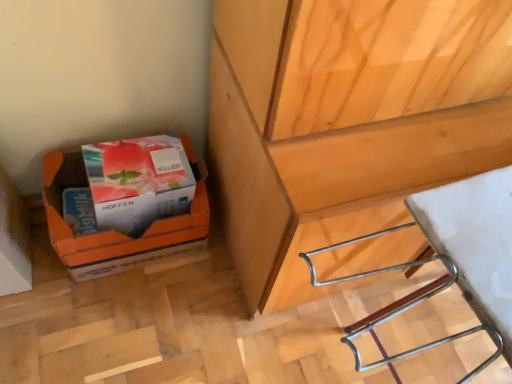
Image resolution: width=512 pixels, height=384 pixels. Identify the location of orange cardboard box at lower left. (115, 231).

You are a GUI agent. You are given a task and a screenshot of the screen. Output one action in this format:
    pyautogui.click(x=<x>, y=<y>)
    Task: Click on the white plastic stool at lower right
    
    Given the screenshot: What is the action you would take?
    pyautogui.click(x=460, y=258)

Is white plastic stool at lower right further to camera compared to orange cardboard box at lower left?

No, white plastic stool at lower right is closer to the viewer.

Considering the sizes of objects white plastic stool at lower right and orange cardboard box at lower left in the image provided, who is shorter, white plastic stool at lower right or orange cardboard box at lower left?

orange cardboard box at lower left is shorter.

How many degrees apart are the facing directions of white plastic stool at lower right and orange cardboard box at lower left?

white plastic stool at lower right and orange cardboard box at lower left are facing 5.37 degrees away from each other.

Is white plastic stool at lower right facing towards orange cardboard box at lower left?

No, white plastic stool at lower right is not oriented towards orange cardboard box at lower left.

Between point (200, 217) and point (168, 165), which one is positioned behind?

The point (200, 217) is farther.

Considering their positions, is orange cardboard box at lower left located in front of or behind matte white box at lower left?

Clearly, orange cardboard box at lower left is behind matte white box at lower left.

Considering the sizes of objects orange cardboard box at lower left and matte white box at lower left in the image provided, who is shorter, orange cardboard box at lower left or matte white box at lower left?

Standing shorter between the two is matte white box at lower left.

From their relative heights in the image, would you say matte white box at lower left is taller or shorter than orange cardboard box at lower left?

matte white box at lower left is shorter than orange cardboard box at lower left.

Which of these two, matte white box at lower left or orange cardboard box at lower left, is thinner?

matte white box at lower left.

From a real-world perspective, which is physically above, matte white box at lower left or orange cardboard box at lower left?

matte white box at lower left.

Looking at this image, are matte white box at lower left and white plastic stool at lower right making contact?

No, matte white box at lower left is not making contact with white plastic stool at lower right.

From the picture: In terms of width, does matte white box at lower left look wider or thinner when compared to white plastic stool at lower right?

matte white box at lower left is thinner than white plastic stool at lower right.

Is white plastic stool at lower right at the back of matte white box at lower left?

No, white plastic stool at lower right is not at the back of matte white box at lower left.

From the image's perspective, which object appears higher, matte white box at lower left or white plastic stool at lower right?

matte white box at lower left.

Between white plastic stool at lower right and matte white box at lower left, which one appears on the left side from the viewer's perspective?

matte white box at lower left is more to the left.

How different are the orientations of white plastic stool at lower right and matte white box at lower left in degrees?

5.37 degrees.

Considering the points (503, 287) and (164, 171), which point is behind, point (503, 287) or point (164, 171)?

The point (164, 171) is farther from the camera.

Which object is wider, white plastic stool at lower right or matte white box at lower left?

white plastic stool at lower right.

Is orange cardboard box at lower left further to camera compared to white plastic stool at lower right?

Yes, it is behind white plastic stool at lower right.

Based on the photo, from a real-world perspective, relative to white plastic stool at lower right, is orange cardboard box at lower left vertically above or below?

In terms of real-world spatial position, orange cardboard box at lower left is below white plastic stool at lower right.

Could you tell me if orange cardboard box at lower left is turned towards white plastic stool at lower right?

No, orange cardboard box at lower left is not oriented towards white plastic stool at lower right.

Considering the relative sizes of orange cardboard box at lower left and white plastic stool at lower right in the image provided, is orange cardboard box at lower left taller than white plastic stool at lower right?

Incorrect, the height of orange cardboard box at lower left is not larger of that of white plastic stool at lower right.

Where is `wood on the right of orange cardboard box at lower left`? This screenshot has height=384, width=512. wood on the right of orange cardboard box at lower left is located at coordinates (460, 258).

Locate an element on the screen. paperback book that is in front of the orange cardboard box at lower left is located at coordinates (138, 182).

Which object lies nearer to the anchor point orange cardboard box at lower left, white plastic stool at lower right or matte white box at lower left?

matte white box at lower left is closer to orange cardboard box at lower left.

Estimate the real-world distances between objects in this image. Which object is further from matte white box at lower left, orange cardboard box at lower left or white plastic stool at lower right?

white plastic stool at lower right is further to matte white box at lower left.

Which object lies further to the anchor point white plastic stool at lower right, orange cardboard box at lower left or matte white box at lower left?

orange cardboard box at lower left is further to white plastic stool at lower right.

Looking at the image, which one is located closer to matte white box at lower left, white plastic stool at lower right or orange cardboard box at lower left?

orange cardboard box at lower left is closer to matte white box at lower left.

Based on their spatial positions, is matte white box at lower left or orange cardboard box at lower left further from white plastic stool at lower right?

The object further to white plastic stool at lower right is orange cardboard box at lower left.

Based on their spatial positions, is matte white box at lower left or white plastic stool at lower right closer to orange cardboard box at lower left?

matte white box at lower left is positioned closer to the anchor orange cardboard box at lower left.

The height and width of the screenshot is (384, 512). In order to click on paperback book between orange cardboard box at lower left and white plastic stool at lower right from left to right in this screenshot , I will do `click(138, 182)`.